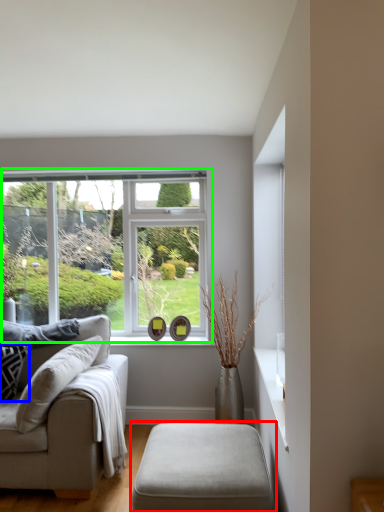
Question: Considering the real-world distances, which object is closest to table (highlighted by a red box)? pillow (highlighted by a blue box) or window (highlighted by a green box).

Choices:
 (A) pillow
 (B) window

Answer: (A)